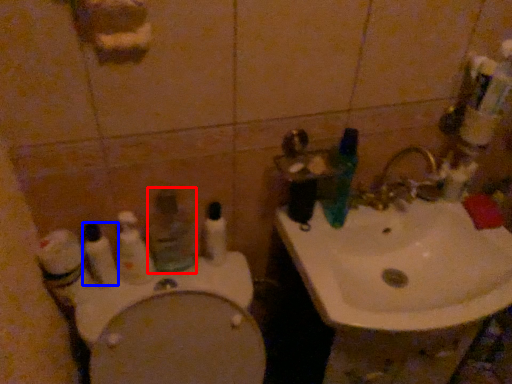
Question: Which point is further to the camera, mouthwash (highlighted by a red box) or toothbrush (highlighted by a blue box)?

Choices:
 (A) mouthwash
 (B) toothbrush

Answer: (A)